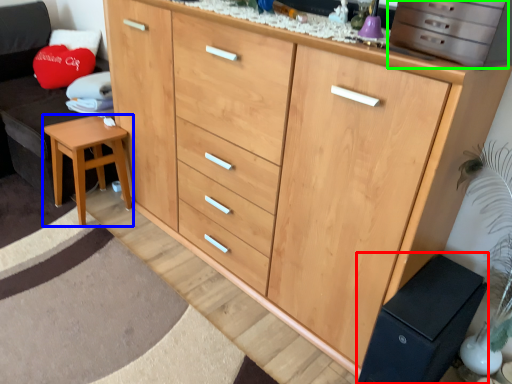
Question: Considering the real-world distances, which object is farthest from changing table (highlighted by a red box)? stool (highlighted by a blue box) or cabinetry (highlighted by a green box)?

Choices:
 (A) stool
 (B) cabinetry

Answer: (A)